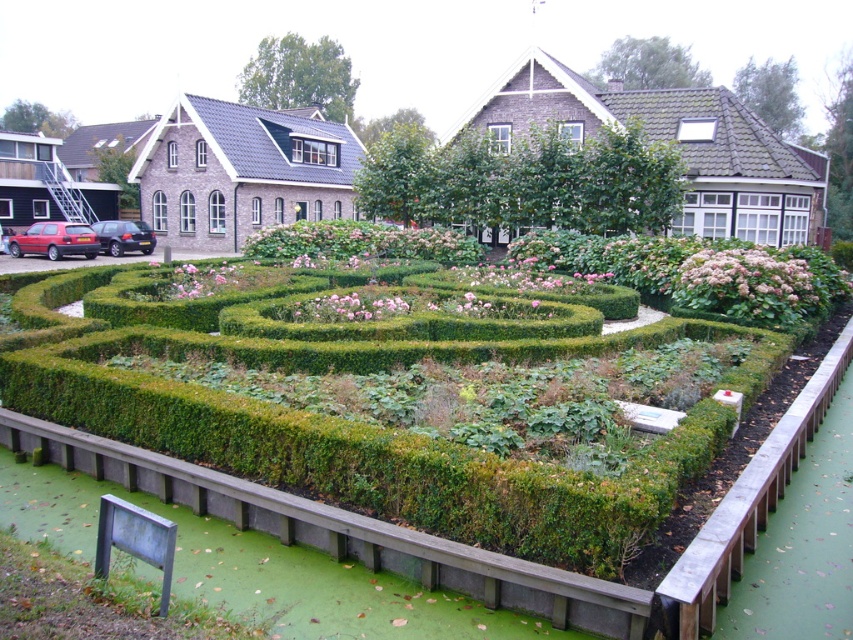
The width and height of the screenshot is (853, 640). I want to click on green hedge maze at center, so click(x=363, y=452).

From the picture: Who is more forward, (486, 465) or (596, 180)?

Point (486, 465)

Locate an element on the screen. green hedge maze at center is located at coordinates (363, 452).